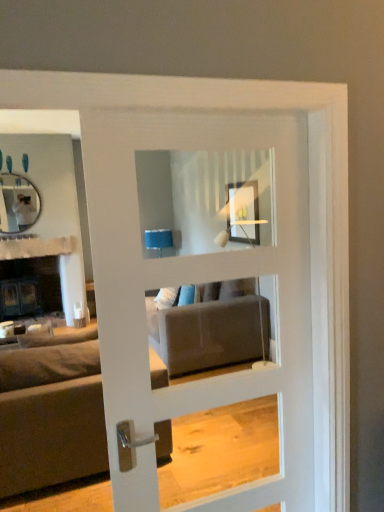
Question: From a real-world perspective, is dark gray fabric couch at left under white textured fabric at upper left?

Choices:
 (A) yes
 (B) no

Answer: (A)

Question: Does dark gray fabric couch at left contain white textured fabric at upper left?

Choices:
 (A) yes
 (B) no

Answer: (B)

Question: Is dark gray fabric couch at left behind white textured fabric at upper left?

Choices:
 (A) yes
 (B) no

Answer: (B)

Question: Does dark gray fabric couch at left have a lesser width compared to white textured fabric at upper left?

Choices:
 (A) yes
 (B) no

Answer: (B)

Question: From the image's perspective, is dark gray fabric couch at left below white textured fabric at upper left?

Choices:
 (A) no
 (B) yes

Answer: (B)

Question: Is dark gray fabric couch at left to the left of white textured fabric at upper left from the viewer's perspective?

Choices:
 (A) yes
 (B) no

Answer: (B)

Question: Is matte black mirror at upper left behind white glossy door at center?

Choices:
 (A) yes
 (B) no

Answer: (A)

Question: From the image's perspective, is matte black mirror at upper left located above white glossy door at center?

Choices:
 (A) yes
 (B) no

Answer: (A)

Question: Is white glossy door at center at the back of matte black mirror at upper left?

Choices:
 (A) no
 (B) yes

Answer: (A)

Question: Can you confirm if matte black mirror at upper left is positioned to the right of white glossy door at center?

Choices:
 (A) yes
 (B) no

Answer: (B)

Question: Can we say matte black mirror at upper left lies outside white glossy door at center?

Choices:
 (A) yes
 (B) no

Answer: (A)

Question: Considering the relative sizes of matte black mirror at upper left and white glossy door at center in the image provided, is matte black mirror at upper left wider than white glossy door at center?

Choices:
 (A) no
 (B) yes

Answer: (A)

Question: Can you confirm if white glossy door at center is positioned to the left of dark gray fabric couch at left?

Choices:
 (A) yes
 (B) no

Answer: (B)